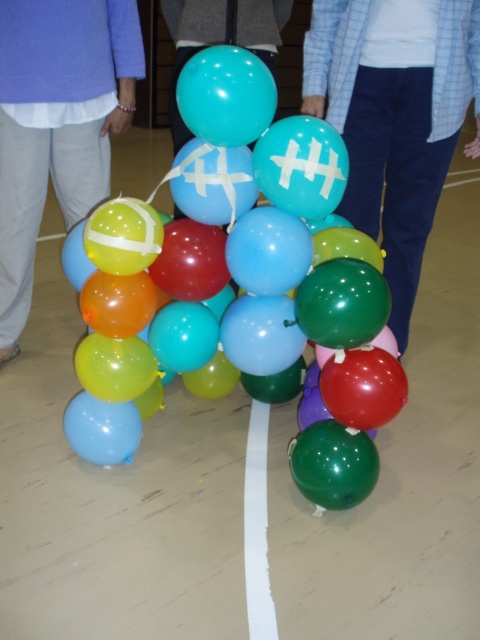
You are an observer standing in front of the balloon structure. You notice two items in the scene. One is the blue plaid shirt at center and the other is the matte blue pants at lower left. Which of these two items is bigger in size?

The blue plaid shirt at center is larger in size compared to the matte blue pants at lower left according to the description.

You are standing in a room with a balloon structure. You see the glossy rubber balloons at center and the glossy teal balloon at center. Which one is closer to you?

The glossy rubber balloons at center is closer to you because it is in front of the glossy teal balloon at center.

You are a delivery robot with a 30 cm wide package. You need to move from the matte blue pants at lower left to the glossy teal balloon at center. Can you navigate the space between them without hitting anything?

The matte blue pants at lower left is 42.50 centimeters away from the glossy teal balloon at center. Since the package is 30 cm wide, there is enough space to navigate between them without any obstruction.